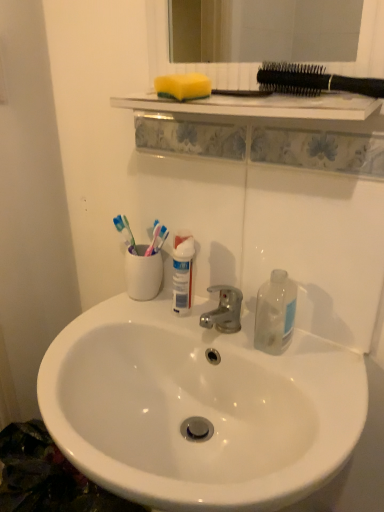
This screenshot has width=384, height=512. What are the coordinates of `free location in front of transparent plastic bottle at right` in the screenshot? It's located at (305, 386).